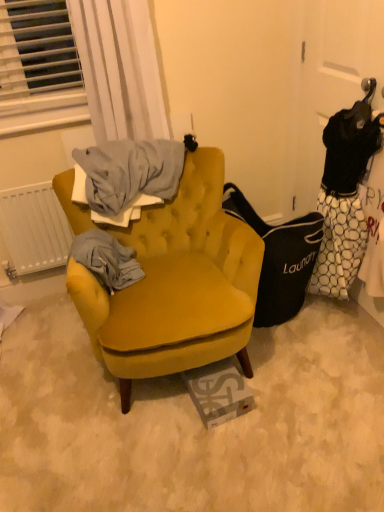
Question: From a real-world perspective, is velvet mustard armchair at center positioned above or below white matte radiator at left?

Choices:
 (A) below
 (B) above

Answer: (A)

Question: Would you say velvet mustard armchair at center is to the left or to the right of white matte radiator at left in the picture?

Choices:
 (A) left
 (B) right

Answer: (B)

Question: Which object is the closest to the white dotted fabric at right?

Choices:
 (A) white sheer curtain at upper left
 (B) velvet mustard armchair at center
 (C) white matte radiator at left
 (D) black fabric laundry bag at right

Answer: (D)

Question: Estimate the real-world distances between objects in this image. Which object is farther from the velvet mustard armchair at center?

Choices:
 (A) white dotted fabric at right
 (B) black fabric laundry bag at right
 (C) white matte radiator at left
 (D) white sheer curtain at upper left

Answer: (A)